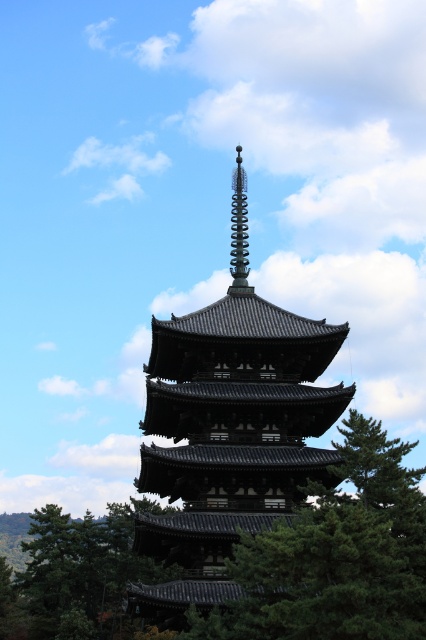
Where is `shiny dark gray pagoda at center`? shiny dark gray pagoda at center is located at coordinates (229, 436).

Which is behind, point (247, 420) or point (2, 602)?

The point (2, 602) is behind.

Locate an element on the screen. Image resolution: width=426 pixels, height=640 pixels. shiny dark gray pagoda at center is located at coordinates (x=229, y=436).

Which of these two, green leafy tree at lower left or spiral metal spire at upper center, stands taller?

With more height is green leafy tree at lower left.

Identify the location of green leafy tree at lower left. This screenshot has width=426, height=640. (77, 577).

Looking at this image, is shiny dark gray pagoda at center thinner than spiral metal spire at upper center?

In fact, shiny dark gray pagoda at center might be wider than spiral metal spire at upper center.

Does shiny dark gray pagoda at center have a lesser height compared to spiral metal spire at upper center?

In fact, shiny dark gray pagoda at center may be taller than spiral metal spire at upper center.

Does point (204, 355) come in front of point (241, 269)?

Yes, point (204, 355) is in front of point (241, 269).

Image resolution: width=426 pixels, height=640 pixels. What are the coordinates of `shiny dark gray pagoda at center` in the screenshot? It's located at (229, 436).